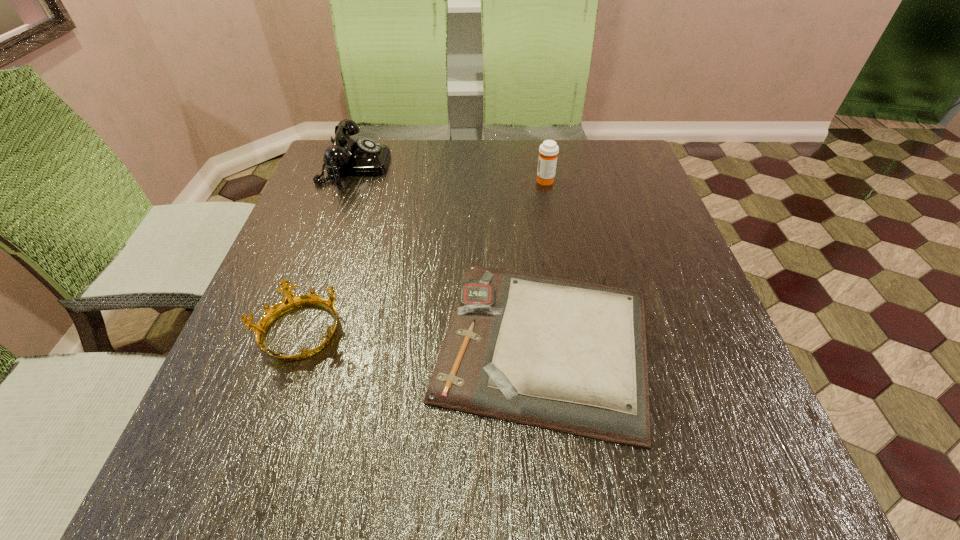
Where is `empty location between the crown and the medicine`? The image size is (960, 540). empty location between the crown and the medicine is located at coordinates (422, 256).

Find the location of a particular element. free space between the medicine and the telephone is located at coordinates (450, 173).

Identify which object is located as the third nearest to the crown. Please provide its 2D coordinates. Your answer should be formatted as a tuple, i.e. [(x, y)], where the tuple contains the x and y coordinates of a point satisfying the conditions above.

[(548, 151)]

Where is `object that is the closest to the third tallest object`? This screenshot has width=960, height=540. object that is the closest to the third tallest object is located at coordinates (570, 356).

Where is `vacant space that satisfies the following two spatial constraints: 1. on the dial of the third tallest object; 2. on the right side of the telephone`? vacant space that satisfies the following two spatial constraints: 1. on the dial of the third tallest object; 2. on the right side of the telephone is located at coordinates (295, 333).

Where is `free location that satisfies the following two spatial constraints: 1. on the dial of the telephone; 2. on the left side of the medicine`? The width and height of the screenshot is (960, 540). free location that satisfies the following two spatial constraints: 1. on the dial of the telephone; 2. on the left side of the medicine is located at coordinates (350, 180).

The height and width of the screenshot is (540, 960). In order to click on blank space that satisfies the following two spatial constraints: 1. on the dial of the telephone; 2. on the right side of the crown in this screenshot , I will do `click(295, 333)`.

At what (x,y) coordinates should I click in order to perform the action: click on free spot that satisfies the following two spatial constraints: 1. on the dial of the medicine; 2. on the left side of the telephone. Please return your answer as a coordinate pair (x, y). Looking at the image, I should click on (350, 180).

Find the location of `vacant space that satisfies the following two spatial constraints: 1. on the dial of the crown; 2. on the right side of the telephone`. vacant space that satisfies the following two spatial constraints: 1. on the dial of the crown; 2. on the right side of the telephone is located at coordinates (295, 333).

Locate an element on the screen. free region that satisfies the following two spatial constraints: 1. on the dial of the telephone; 2. on the right side of the shortest object is located at coordinates (291, 343).